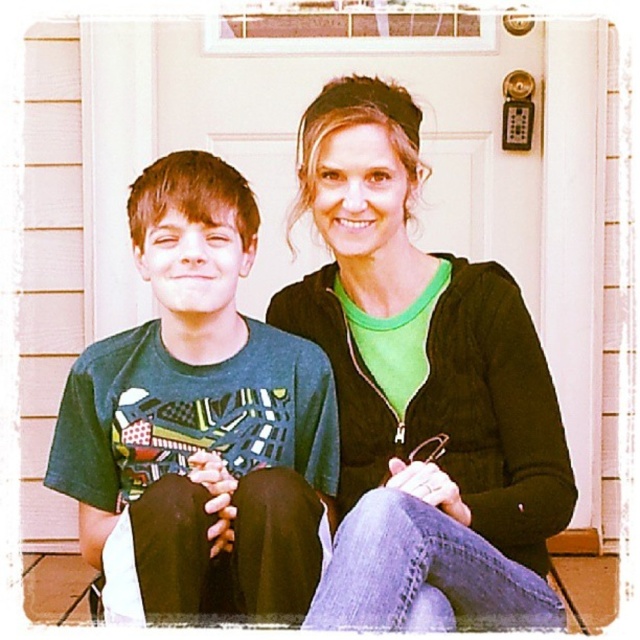
Does green matte jacket at center have a greater height compared to green matte shirt at center?

Yes, green matte jacket at center is taller than green matte shirt at center.

Where is `green matte jacket at center`? This screenshot has height=640, width=640. green matte jacket at center is located at coordinates (420, 385).

At what (x,y) coordinates should I click in order to perform the action: click on green matte jacket at center. Please return your answer as a coordinate pair (x, y). This screenshot has width=640, height=640. Looking at the image, I should click on (420, 385).